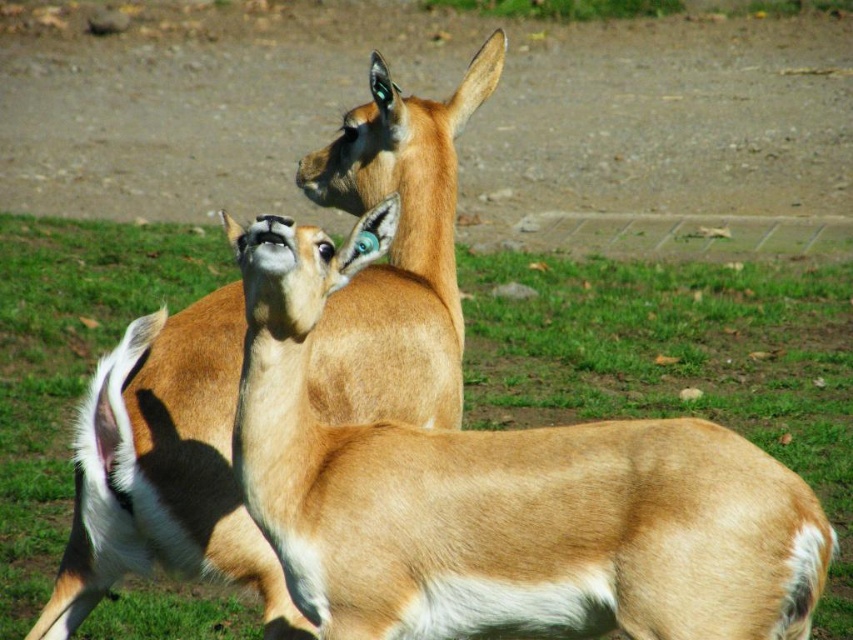
Does brown furry deer at center have a lesser height compared to brown furry deer at upper center?

Correct, brown furry deer at center is not as tall as brown furry deer at upper center.

Which of these two, brown furry deer at center or brown furry deer at upper center, stands taller?

With more height is brown furry deer at upper center.

Does point (434, 500) lie in front of point (137, 472)?

Yes, it is in front of point (137, 472).

The height and width of the screenshot is (640, 853). I want to click on brown furry deer at center, so click(x=502, y=499).